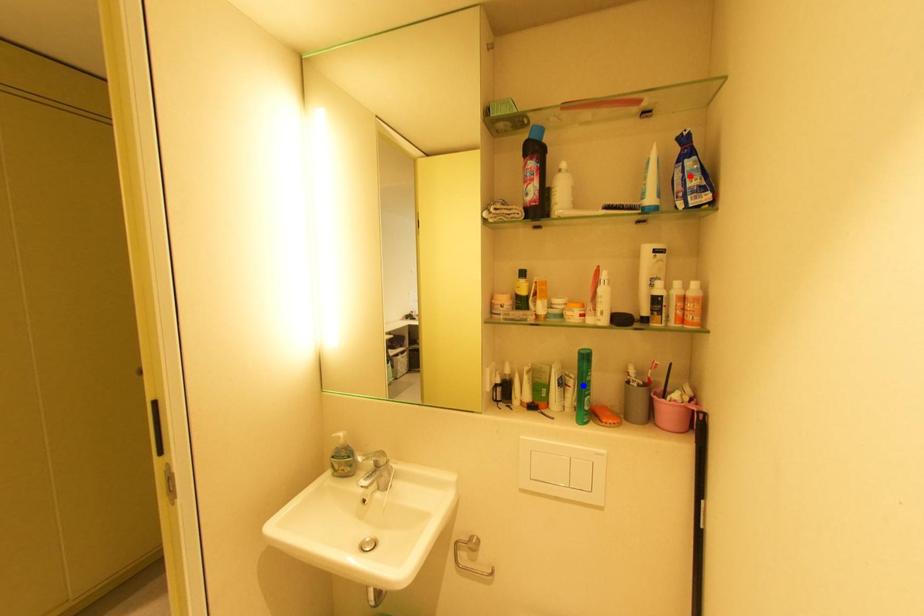
Question: Two points are marked on the image. Which point is closer to the camera?

Choices:
 (A) Blue point is closer.
 (B) Red point is closer.

Answer: (B)